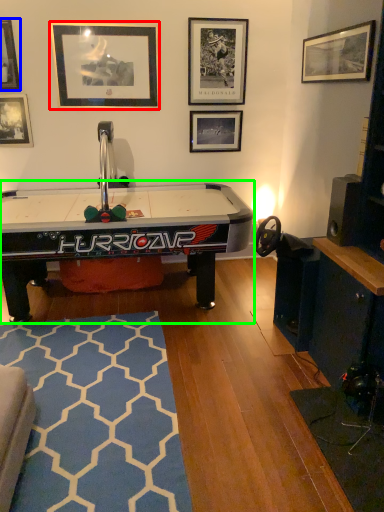
Question: Considering the real-world distances, which object is farthest from picture frame (highlighted by a red box)? picture frame (highlighted by a blue box) or table (highlighted by a green box)?

Choices:
 (A) picture frame
 (B) table

Answer: (B)